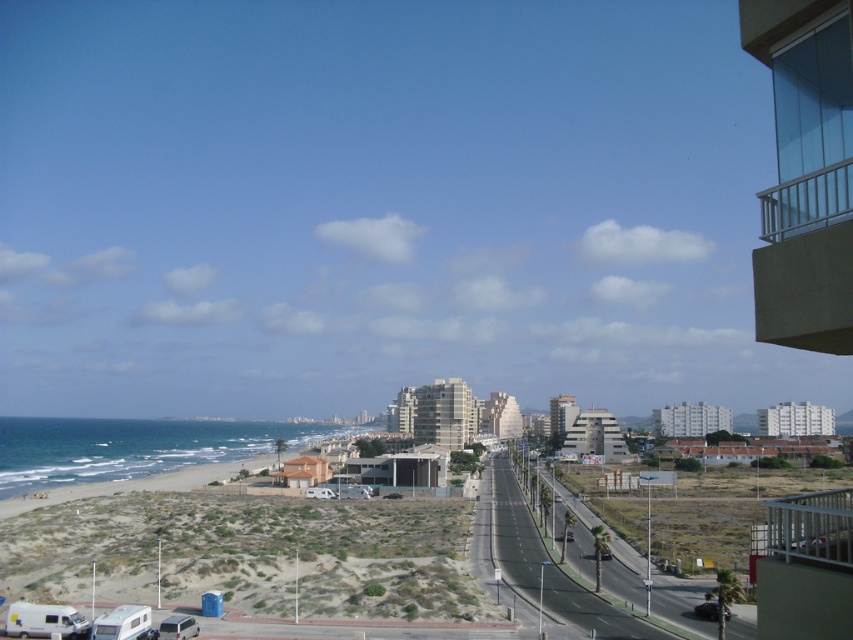
Question: Is clear glass balcony at upper right above white matte camper van at lower left?

Choices:
 (A) yes
 (B) no

Answer: (A)

Question: Estimate the real-world distances between objects in this image. Which object is closer to the white matte camper at lower left?

Choices:
 (A) clear glass balcony at upper right
 (B) white matte camper van at lower left
 (C) metallic silver railing at upper right

Answer: (B)

Question: Which is farther from the white matte camper van at lower left?

Choices:
 (A) clear glass balcony at upper right
 (B) metallic silver railing at upper right
 (C) white matte camper at lower left

Answer: (A)

Question: Does clear glass balcony at upper right appear on the right side of white matte camper van at lower left?

Choices:
 (A) yes
 (B) no

Answer: (A)

Question: Which object is farther from the camera taking this photo?

Choices:
 (A) white matte camper at lower left
 (B) metallic silver railing at upper right
 (C) clear glass balcony at upper right
 (D) white matte camper van at lower left

Answer: (D)

Question: Considering the relative positions of clear glass balcony at upper right and white matte camper van at lower left in the image provided, where is clear glass balcony at upper right located with respect to white matte camper van at lower left?

Choices:
 (A) right
 (B) left

Answer: (A)